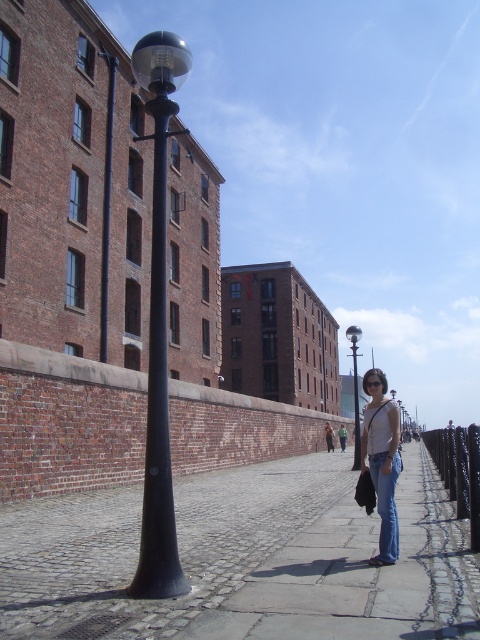
Question: Which of the following is the farthest from the observer?

Choices:
 (A) (260, 524)
 (B) (360, 333)
 (C) (383, 378)
 (D) (148, 582)

Answer: (B)

Question: Observing the image, what is the correct spatial positioning of cobblestone pavement at center in reference to black matte lamp post at left?

Choices:
 (A) right
 (B) left

Answer: (A)

Question: Which object appears farthest from the camera in this image?

Choices:
 (A) denim jeans at center
 (B) cobblestone pavement at center

Answer: (A)

Question: Which is nearer to the black polished metal streetlight at center?

Choices:
 (A) denim jeans at center
 (B) black matte lamp post at left
 (C) cobblestone pavement at center

Answer: (A)

Question: Is cobblestone pavement at center in front of black matte lamp post at left?

Choices:
 (A) yes
 (B) no

Answer: (A)

Question: Is cobblestone pavement at center behind denim jeans at center?

Choices:
 (A) no
 (B) yes

Answer: (A)